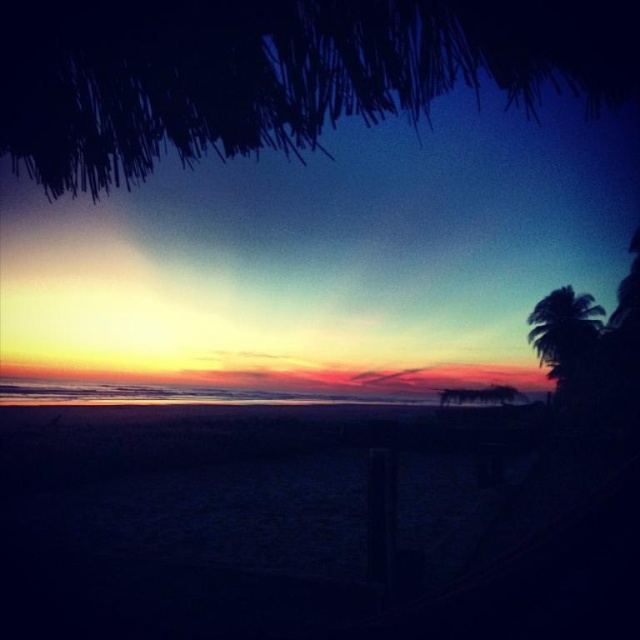
Question: Which object appears closest to the camera in this image?

Choices:
 (A) silhouette leafy palm at right
 (B) dark sand at lower center

Answer: (B)

Question: Which of the following is the farthest from the observer?

Choices:
 (A) (451, 573)
 (B) (595, 330)

Answer: (B)

Question: Does dark sand at lower center appear on the left side of silhouette leafy palm at right?

Choices:
 (A) no
 (B) yes

Answer: (B)

Question: Is dark sand at lower center to the right of silhouette leafy palm at right from the viewer's perspective?

Choices:
 (A) yes
 (B) no

Answer: (B)

Question: Is dark sand at lower center further to the viewer compared to silhouette leafy palm at right?

Choices:
 (A) no
 (B) yes

Answer: (A)

Question: Which of the following is the closest to the observer?

Choices:
 (A) (538, 323)
 (B) (483, 570)

Answer: (B)